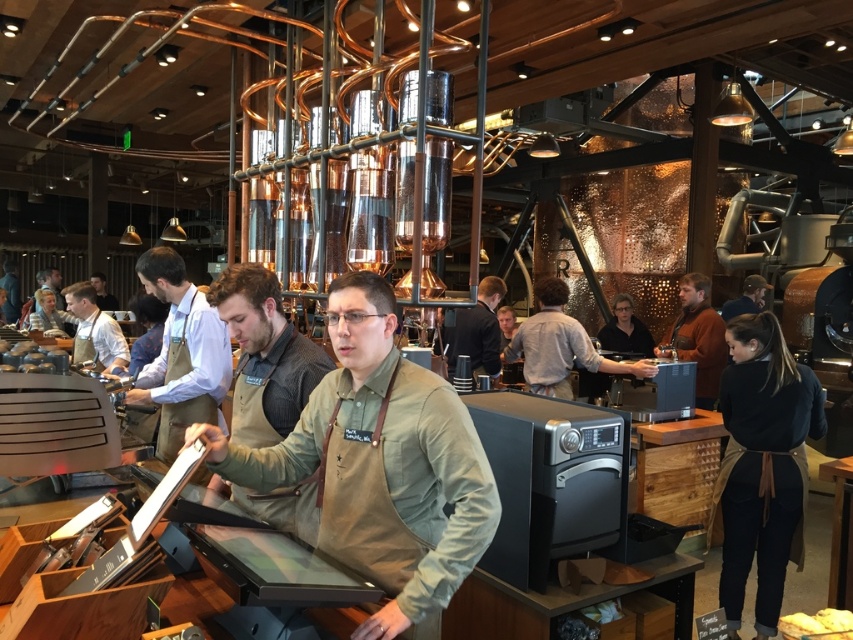
Who is higher up, black fabric apron at right or matte brown leather jacket at upper right?

matte brown leather jacket at upper right is higher up.

Who is taller, black fabric apron at right or matte brown leather jacket at upper right?

black fabric apron at right

Is point (753, 392) positioned behind point (726, 314)?

No, (753, 392) is in front of (726, 314).

Where is `black fabric apron at right`? Image resolution: width=853 pixels, height=640 pixels. black fabric apron at right is located at coordinates (762, 465).

Does tan canvas apron at center appear under matte black apron at center?

Indeed, tan canvas apron at center is positioned under matte black apron at center.

Is tan canvas apron at center positioned before matte black apron at center?

Yes, it is.

Locate an element on the screen. tan canvas apron at center is located at coordinates (381, 465).

Is brown leather jacket at upper right positioned at the back of matte black apron at center?

No.

From the picture: Who is positioned more to the left, brown leather jacket at upper right or matte black apron at center?

matte black apron at center is more to the left.

Who is more distant from viewer, (688, 346) or (102, 284)?

Point (102, 284)

Where is `brown leather jacket at upper right`? Image resolution: width=853 pixels, height=640 pixels. brown leather jacket at upper right is located at coordinates (697, 337).